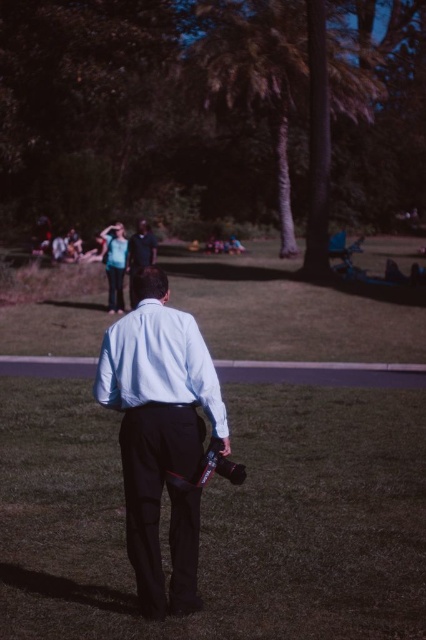
Question: Which object is closer to the camera taking this photo?

Choices:
 (A) light blue shirt at center
 (B) black smooth pants at center

Answer: (A)

Question: Is black smooth pants at center to the right of green grass at center from the viewer's perspective?

Choices:
 (A) yes
 (B) no

Answer: (B)

Question: From the image, what is the correct spatial relationship of green grass at center in relation to matte black shirt at center?

Choices:
 (A) left
 (B) right

Answer: (B)

Question: Which object is closer to the camera taking this photo?

Choices:
 (A) light blue shirt at center
 (B) light blue cotton dress shirt at center

Answer: (B)

Question: Which point is farther from the camera taking this photo?

Choices:
 (A) (193, 298)
 (B) (261, 483)
 (C) (186, 440)

Answer: (A)

Question: Does green grass at center appear under light blue cotton dress shirt at center?

Choices:
 (A) no
 (B) yes

Answer: (A)